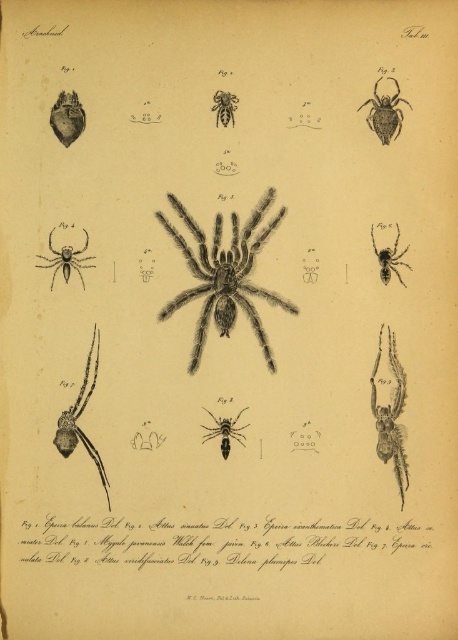
Based on the photo, you are an entomologist examining this page from an old scientific text. You notice two matte black spiders labeled in the illustration. Which of the two, the matte black spider at upper right or the matte black spider at upper left, is smaller in size?

The matte black spider at upper right is smaller compared to the matte black spider at upper left.

You are a researcher examining this scientific illustration. You need to locate the shiny metallic spider at right and the black fuzzy spider at center. According to the illustration, which one is positioned higher on the page?

The shiny metallic spider at right is located above the black fuzzy spider at center, so it is positioned higher on the page.